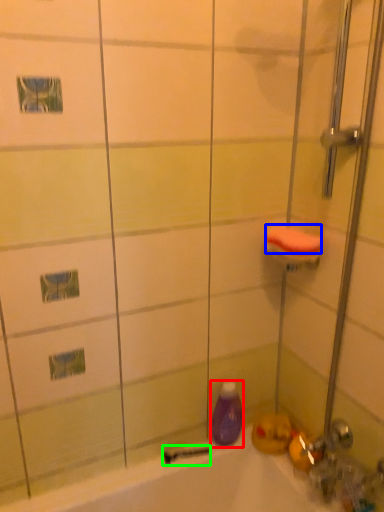
Question: Based on their relative distances, which object is farther from cleaning product (highlighted by a red box)? Choose from soap (highlighted by a blue box) and shower (highlighted by a green box).

Choices:
 (A) soap
 (B) shower

Answer: (A)